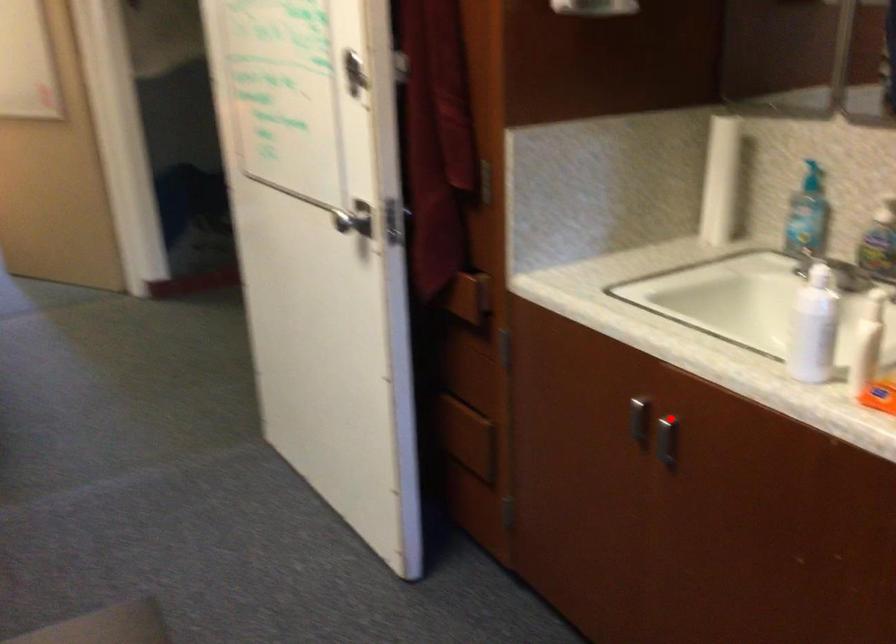
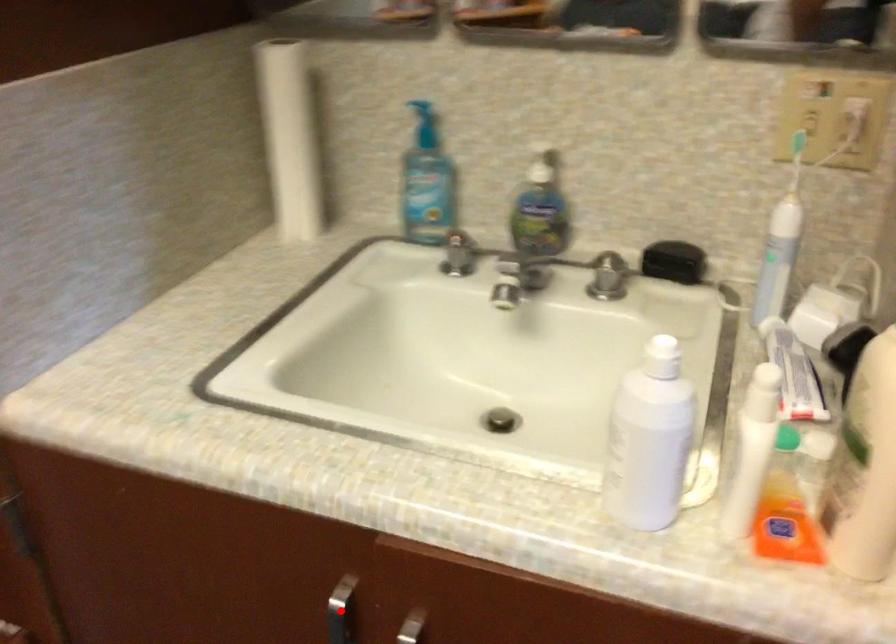
I am providing you with two images of the same scene from different viewpoints. A red point is marked on the first image and another point is marked on the second image. Do the highlighted points in image1 and image2 indicate the same real-world spot?

No